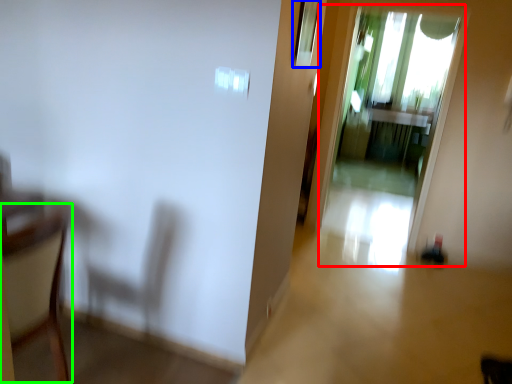
Question: Estimate the real-world distances between objects in this image. Which object is closer to screen door (highlighted by a red box), window (highlighted by a blue box) or armchair (highlighted by a green box)?

Choices:
 (A) window
 (B) armchair

Answer: (A)